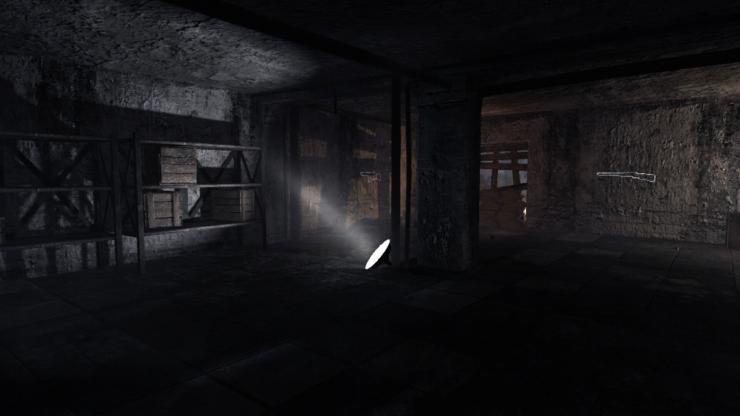
At what (x,y) coordinates should I click in order to perform the action: click on light. Please return your answer as a coordinate pair (x, y). This screenshot has width=740, height=416. Looking at the image, I should click on (379, 256).